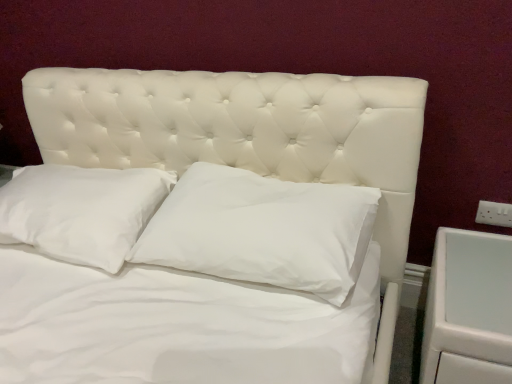
Question: From a real-world perspective, is white soft pillow at center, acting as the 1th pillow starting from the left, above or below white glossy drawer at right?

Choices:
 (A) above
 (B) below

Answer: (A)

Question: Considering the positions of point (146, 193) and point (446, 233), is point (146, 193) closer or farther from the camera than point (446, 233)?

Choices:
 (A) closer
 (B) farther

Answer: (B)

Question: Which object is the closest to the white soft pillow at center, arranged as the 2th pillow when viewed from the right?

Choices:
 (A) white plastic electric outlet at right
 (B) white cotton pillow at center, which is the second pillow from left to right
 (C) white glossy drawer at right

Answer: (B)

Question: Which object is the farthest from the white cotton pillow at center, which is the second pillow from left to right?

Choices:
 (A) white plastic electric outlet at right
 (B) white soft pillow at center, acting as the 1th pillow starting from the left
 (C) white glossy drawer at right

Answer: (A)